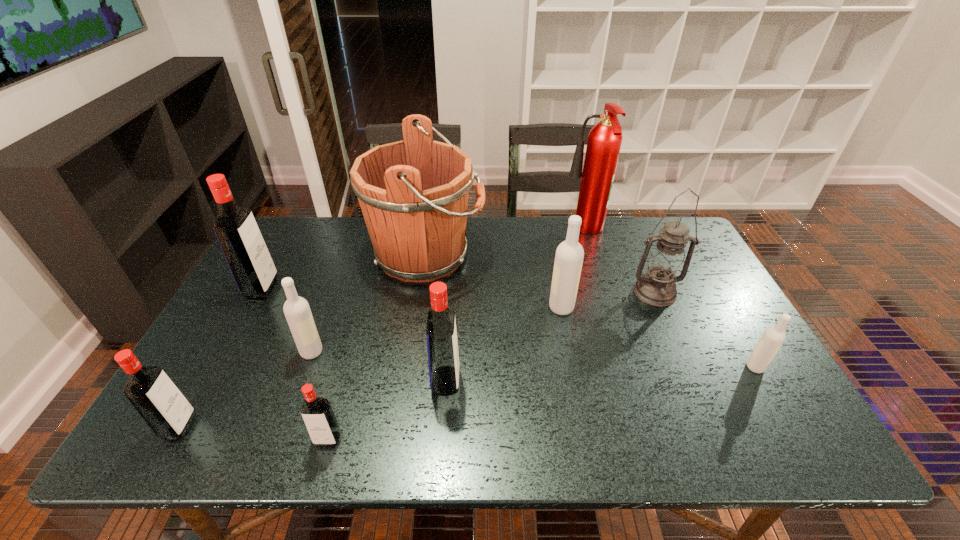
Where is `blank space located at the nozzle of the fire extinguisher`? blank space located at the nozzle of the fire extinguisher is located at coordinates (517, 232).

This screenshot has height=540, width=960. Find the location of `free space located 0.350m with the handle on the side of the bucket`. free space located 0.350m with the handle on the side of the bucket is located at coordinates (594, 254).

The width and height of the screenshot is (960, 540). What are the coordinates of `free space located on the front and back of the tallest vodka` in the screenshot? It's located at (360, 288).

Find the location of `vacant region located on the left of the gray oil lamp`. vacant region located on the left of the gray oil lamp is located at coordinates point(506,292).

Find the location of `free space located 0.160m on the back of the second white vodka from left to right`. free space located 0.160m on the back of the second white vodka from left to right is located at coordinates (552, 264).

Locate an element on the screen. blank space located on the front and back of the rightmost red vodka is located at coordinates (561, 381).

The height and width of the screenshot is (540, 960). In order to click on free location located on the back of the third object from left to right in this screenshot , I will do `click(347, 256)`.

Find the location of `free space located 0.300m on the front and back of the second smallest red vodka`. free space located 0.300m on the front and back of the second smallest red vodka is located at coordinates (329, 426).

At what (x,y) coordinates should I click in order to perform the action: click on free space located 0.190m on the left of the rightmost white vodka. Please return your answer as a coordinate pair (x, y). Looking at the image, I should click on click(668, 367).

What are the coordinates of `fire extinguisher at the far edge` in the screenshot? It's located at (604, 141).